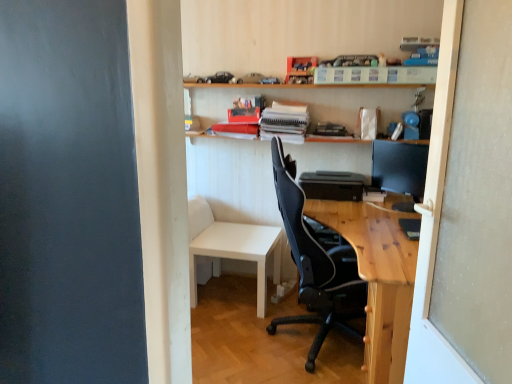
What are the coordinates of `blank space above white matte table at lower center (from a real-world perspective)` in the screenshot? It's located at (234, 235).